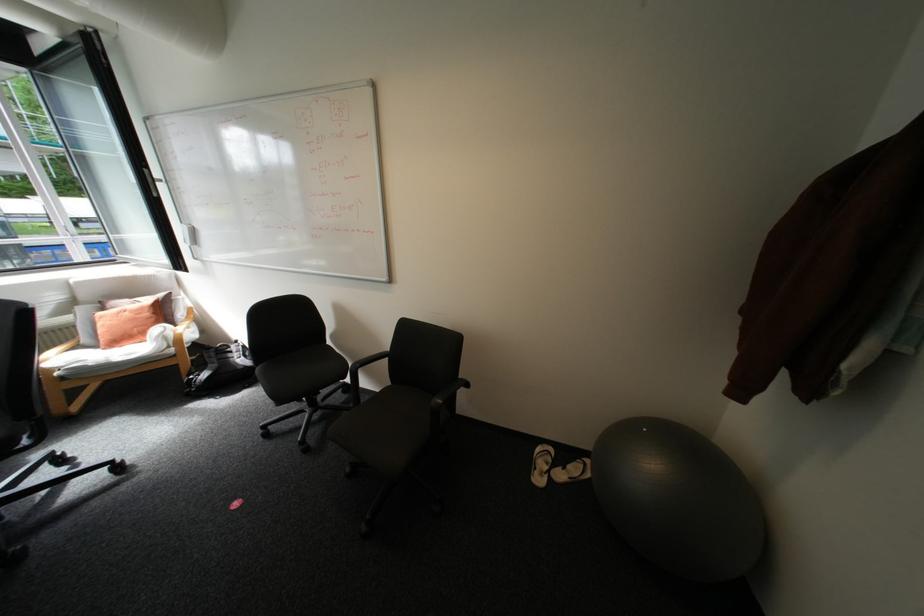
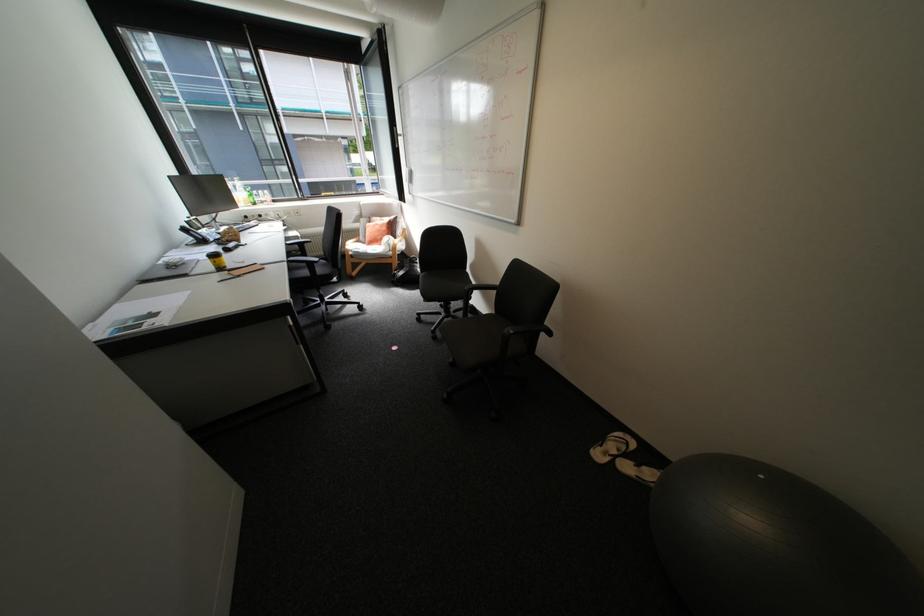
Locate, in the second image, the point that corresponds to point (311, 442) in the first image.

(444, 331)